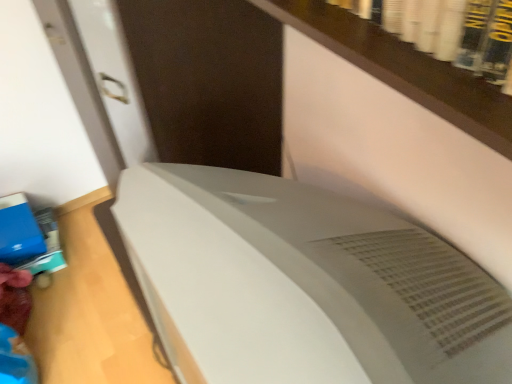
Question: From a real-world perspective, is blue matte book at lower left located higher than satin white air conditioner at center?

Choices:
 (A) no
 (B) yes

Answer: (A)

Question: Is blue matte book at lower left far away from satin white air conditioner at center?

Choices:
 (A) no
 (B) yes

Answer: (B)

Question: Is the depth of blue matte book at lower left greater than that of satin white air conditioner at center?

Choices:
 (A) yes
 (B) no

Answer: (A)

Question: From the image's perspective, would you say blue matte book at lower left is positioned over satin white air conditioner at center?

Choices:
 (A) no
 (B) yes

Answer: (B)

Question: Is blue matte book at lower left bigger than satin white air conditioner at center?

Choices:
 (A) yes
 (B) no

Answer: (B)

Question: Does blue matte book at lower left touch satin white air conditioner at center?

Choices:
 (A) no
 (B) yes

Answer: (A)

Question: Considering the relative sizes of satin white air conditioner at center and blue matte book at lower left in the image provided, is satin white air conditioner at center shorter than blue matte book at lower left?

Choices:
 (A) no
 (B) yes

Answer: (A)

Question: From the image's perspective, is satin white air conditioner at center below blue matte book at lower left?

Choices:
 (A) no
 (B) yes

Answer: (B)

Question: Is the surface of satin white air conditioner at center in direct contact with blue matte book at lower left?

Choices:
 (A) no
 (B) yes

Answer: (A)

Question: Can you confirm if satin white air conditioner at center is positioned to the right of blue matte book at lower left?

Choices:
 (A) yes
 (B) no

Answer: (A)

Question: Does satin white air conditioner at center have a larger size compared to blue matte book at lower left?

Choices:
 (A) no
 (B) yes

Answer: (B)

Question: Is satin white air conditioner at center wider than blue matte book at lower left?

Choices:
 (A) yes
 (B) no

Answer: (A)

Question: Considering the positions of blue matte book at lower left and satin white air conditioner at center in the image, is blue matte book at lower left taller or shorter than satin white air conditioner at center?

Choices:
 (A) tall
 (B) short

Answer: (B)